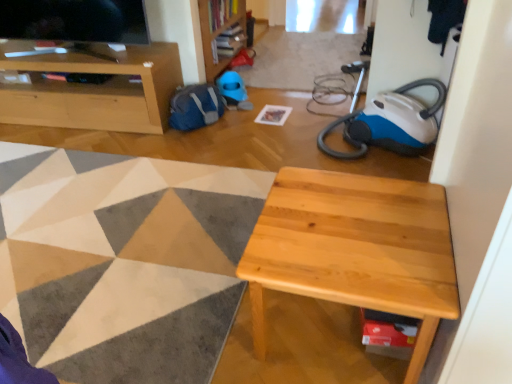
Question: From the image's perspective, would you say matte wood cabinet at upper left is shown under wooden bookshelf at upper center?

Choices:
 (A) no
 (B) yes

Answer: (B)

Question: Is matte wood cabinet at upper left completely or partially outside of wooden bookshelf at upper center?

Choices:
 (A) yes
 (B) no

Answer: (A)

Question: Does matte wood cabinet at upper left have a lesser height compared to wooden bookshelf at upper center?

Choices:
 (A) no
 (B) yes

Answer: (B)

Question: Considering the relative positions of matte wood cabinet at upper left and wooden bookshelf at upper center in the image provided, is matte wood cabinet at upper left to the left of wooden bookshelf at upper center from the viewer's perspective?

Choices:
 (A) no
 (B) yes

Answer: (B)

Question: From the image's perspective, is matte wood cabinet at upper left on top of wooden bookshelf at upper center?

Choices:
 (A) yes
 (B) no

Answer: (B)

Question: Is matte wood cabinet at upper left positioned with its back to wooden bookshelf at upper center?

Choices:
 (A) no
 (B) yes

Answer: (B)

Question: Can you confirm if natural wood table at center is wider than white paper at center?

Choices:
 (A) yes
 (B) no

Answer: (A)

Question: Is natural wood table at center bigger than white paper at center?

Choices:
 (A) yes
 (B) no

Answer: (A)

Question: Can you confirm if natural wood table at center is smaller than white paper at center?

Choices:
 (A) no
 (B) yes

Answer: (A)

Question: Does natural wood table at center have a lesser width compared to white paper at center?

Choices:
 (A) yes
 (B) no

Answer: (B)

Question: Can you confirm if natural wood table at center is positioned to the left of white paper at center?

Choices:
 (A) yes
 (B) no

Answer: (B)

Question: From a real-world perspective, is natural wood table at center below white paper at center?

Choices:
 (A) no
 (B) yes

Answer: (A)

Question: Does wooden bookshelf at upper center have a lesser height compared to matte wood cabinet at upper left?

Choices:
 (A) no
 (B) yes

Answer: (A)